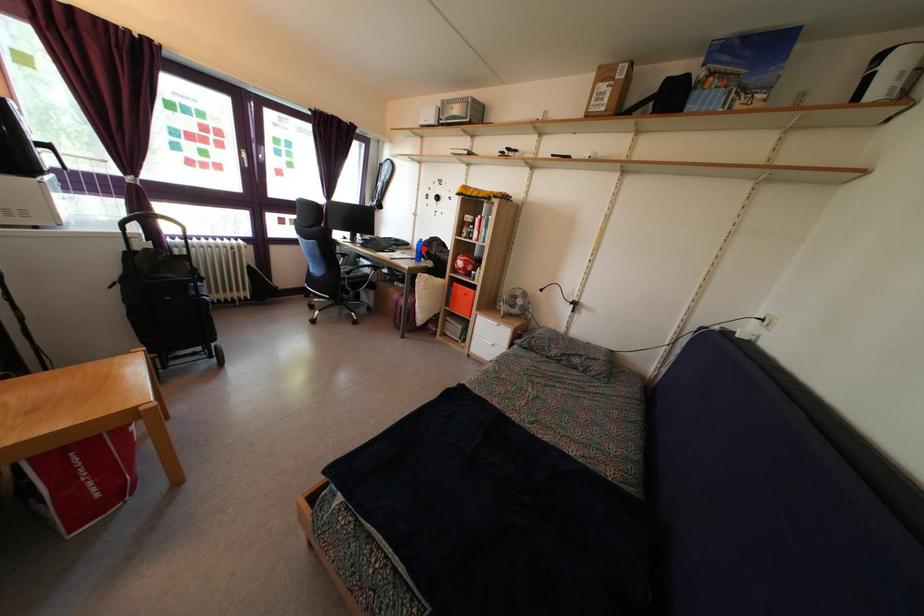
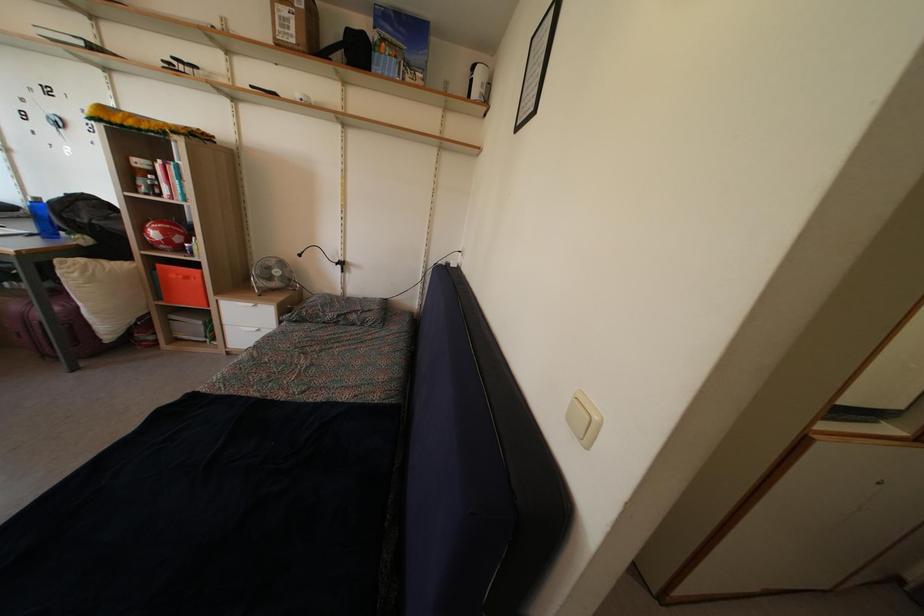
Question: I am providing you with two images of the same scene from different viewpoints. Image1 has a red point marked. In image2, the corresponding 3D location appears at what relative position? Reply with the corresponding letter.

Choices:
 (A) Closer
 (B) Farther

Answer: (B)